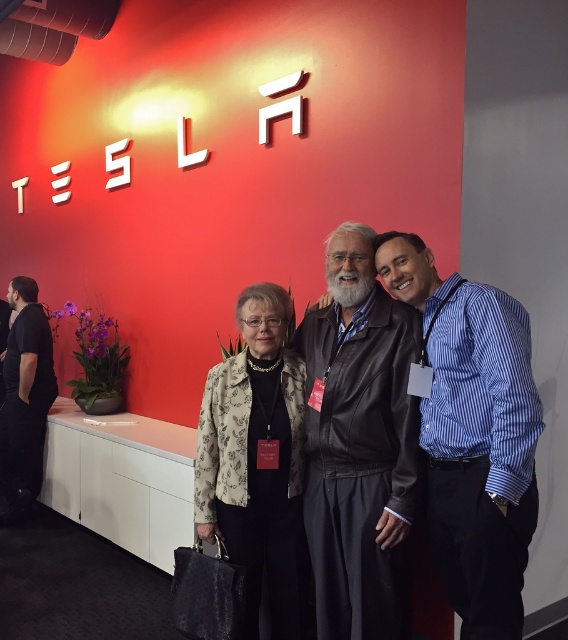
Question: Which of the following is the closest to the observer?

Choices:
 (A) (371, 536)
 (B) (252, 422)

Answer: (A)

Question: Does leather jacket at center have a smaller size compared to blue striped shirt at center?

Choices:
 (A) yes
 (B) no

Answer: (B)

Question: Among these objects, which one is farthest from the camera?

Choices:
 (A) black leather jacket at left
 (B) blue striped shirt at center
 (C) floral-patterned fabric at center

Answer: (A)

Question: Which is nearer to the black leather jacket at left?

Choices:
 (A) leather jacket at center
 (B) blue striped shirt at center
 (C) floral-patterned fabric at center

Answer: (C)

Question: Is the position of floral-patterned fabric at center more distant than that of black leather jacket at left?

Choices:
 (A) no
 (B) yes

Answer: (A)

Question: In this image, where is blue striped shirt at center located relative to floral-patterned fabric at center?

Choices:
 (A) below
 (B) above

Answer: (B)